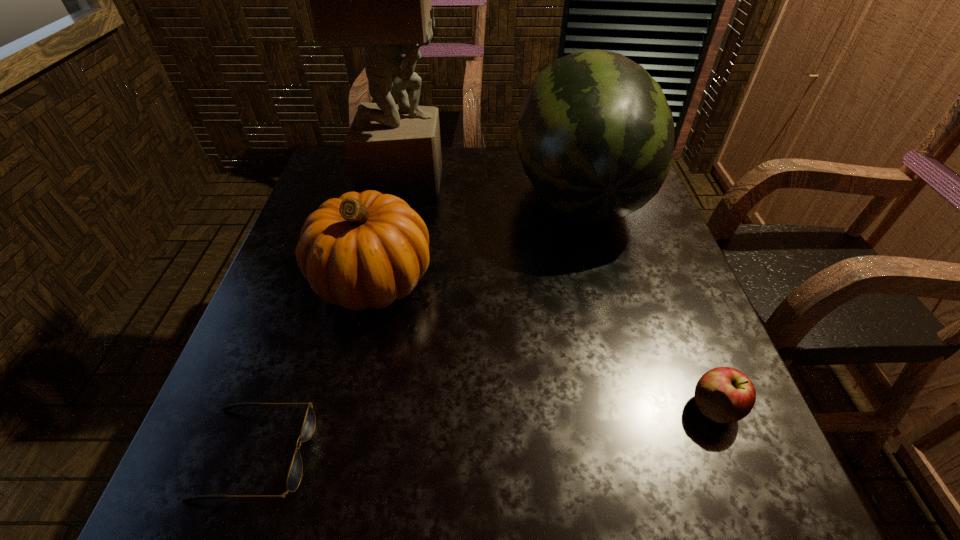
Locate an element on the screen. This screenshot has width=960, height=540. vacant space in between the apple and the watermelon is located at coordinates (647, 301).

At what (x,y) coordinates should I click in order to perform the action: click on free space between the sunglasses and the tallest object. Please return your answer as a coordinate pair (x, y). Looking at the image, I should click on (330, 316).

Image resolution: width=960 pixels, height=540 pixels. I want to click on vacant space that's between the sunglasses and the tallest object, so click(330, 316).

The height and width of the screenshot is (540, 960). What are the coordinates of `free spot between the watermelon and the third shortest object` in the screenshot? It's located at [x=476, y=237].

Identify the location of vacant area that lies between the watermelon and the third tallest object. This screenshot has width=960, height=540. (476, 237).

You are a GUI agent. You are given a task and a screenshot of the screen. Output one action in this format:
    pyautogui.click(x=<x>, y=<y>)
    Task: Click on the free space between the second tallest object and the third tallest object
    
    Given the screenshot: What is the action you would take?
    pyautogui.click(x=476, y=237)

Locate which object is the second closest to the pumpkin. Please provide its 2D coordinates. Your answer should be formatted as a tuple, i.e. [(x, y)], where the tuple contains the x and y coordinates of a point satisfying the conditions above.

[(294, 477)]

You are a GUI agent. You are given a task and a screenshot of the screen. Output one action in this format:
    pyautogui.click(x=<x>, y=<y>)
    Task: Click on the object that is the second closest to the sunglasses
    
    Given the screenshot: What is the action you would take?
    pyautogui.click(x=595, y=136)

Locate an element on the screen. Image resolution: width=960 pixels, height=540 pixels. free space that satisfies the following two spatial constraints: 1. on the back side of the watermelon; 2. on the front-facing side of the sculpture is located at coordinates (575, 178).

Locate an element on the screen. The height and width of the screenshot is (540, 960). free spot that satisfies the following two spatial constraints: 1. on the front-facing side of the sculpture; 2. on the back side of the watermelon is located at coordinates (401, 194).